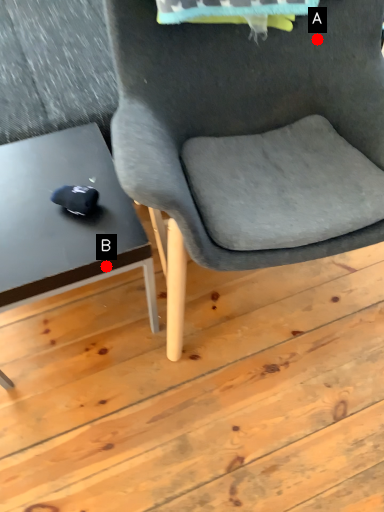
Question: Two points are circled on the image, labeled by A and B beside each circle. Which point is closer to the camera?

Choices:
 (A) A is closer
 (B) B is closer

Answer: (B)